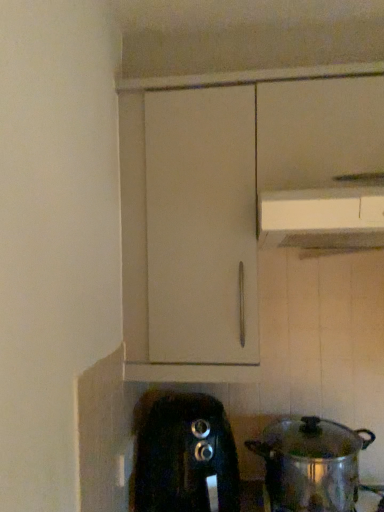
Question: From a real-world perspective, is shiny metallic pot at lower right located beneath black plastic toaster at lower center?

Choices:
 (A) no
 (B) yes

Answer: (A)

Question: From the image's perspective, is shiny metallic pot at lower right beneath black plastic toaster at lower center?

Choices:
 (A) yes
 (B) no

Answer: (B)

Question: Is shiny metallic pot at lower right next to black plastic toaster at lower center?

Choices:
 (A) yes
 (B) no

Answer: (B)

Question: Is shiny metallic pot at lower right aimed at black plastic toaster at lower center?

Choices:
 (A) no
 (B) yes

Answer: (A)

Question: Is shiny metallic pot at lower right shorter than black plastic toaster at lower center?

Choices:
 (A) yes
 (B) no

Answer: (A)

Question: Is shiny metallic pot at lower right further to camera compared to black plastic toaster at lower center?

Choices:
 (A) no
 (B) yes

Answer: (A)

Question: From the image's perspective, would you say white plastic vent at upper center is positioned over black plastic toaster at lower center?

Choices:
 (A) no
 (B) yes

Answer: (B)

Question: Is white plastic vent at upper center aimed at black plastic toaster at lower center?

Choices:
 (A) no
 (B) yes

Answer: (A)

Question: Are white plastic vent at upper center and black plastic toaster at lower center far apart?

Choices:
 (A) yes
 (B) no

Answer: (B)

Question: Considering the relative sizes of white plastic vent at upper center and black plastic toaster at lower center in the image provided, is white plastic vent at upper center smaller than black plastic toaster at lower center?

Choices:
 (A) yes
 (B) no

Answer: (A)

Question: From the image's perspective, would you say white plastic vent at upper center is shown under black plastic toaster at lower center?

Choices:
 (A) no
 (B) yes

Answer: (A)

Question: Considering the relative positions of white plastic vent at upper center and black plastic toaster at lower center in the image provided, is white plastic vent at upper center to the right of black plastic toaster at lower center from the viewer's perspective?

Choices:
 (A) yes
 (B) no

Answer: (A)

Question: Is white plastic vent at upper center facing towards shiny metallic pot at lower right?

Choices:
 (A) no
 (B) yes

Answer: (A)